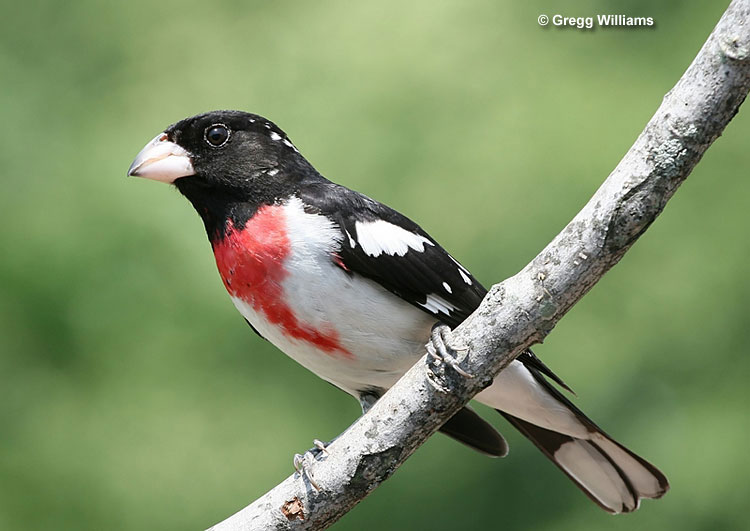
Where is `white fur`? The image size is (750, 531). white fur is located at coordinates (374, 345).